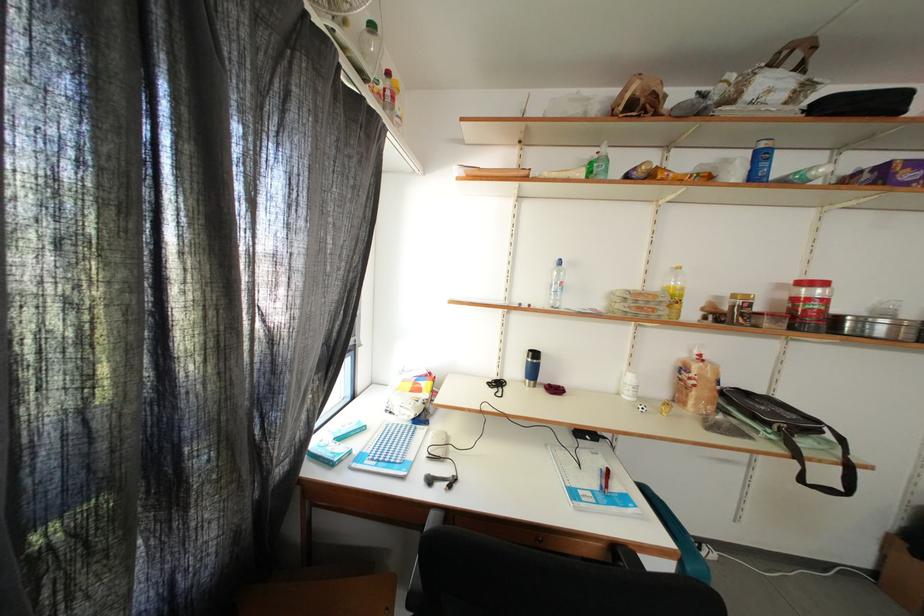
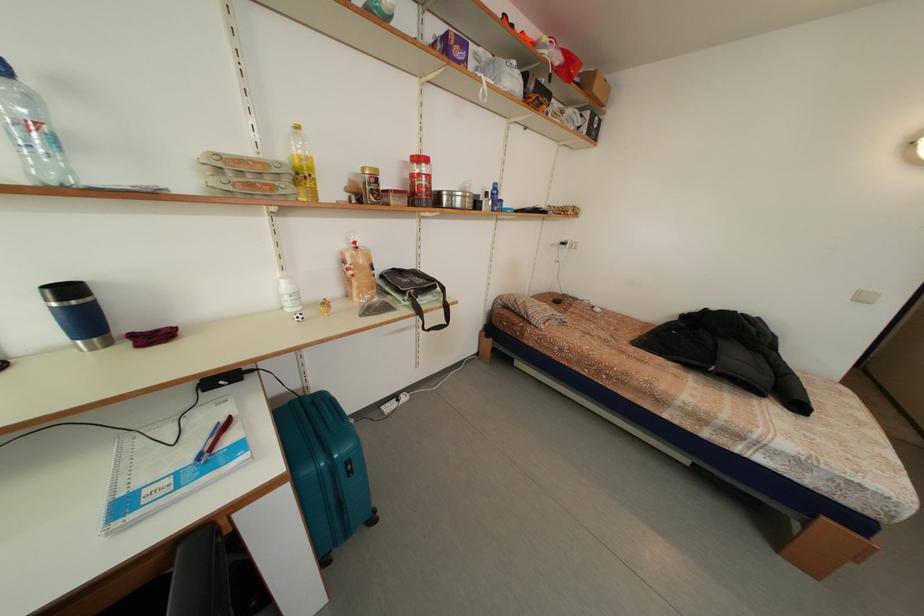
Locate, in the second image, the point that corresponds to the point at 845,464 in the first image.

(448, 310)